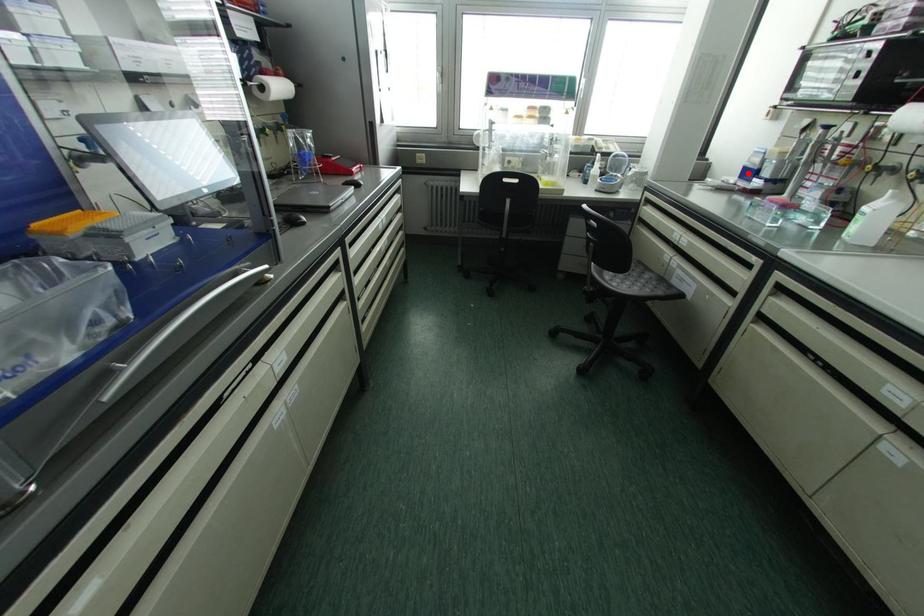
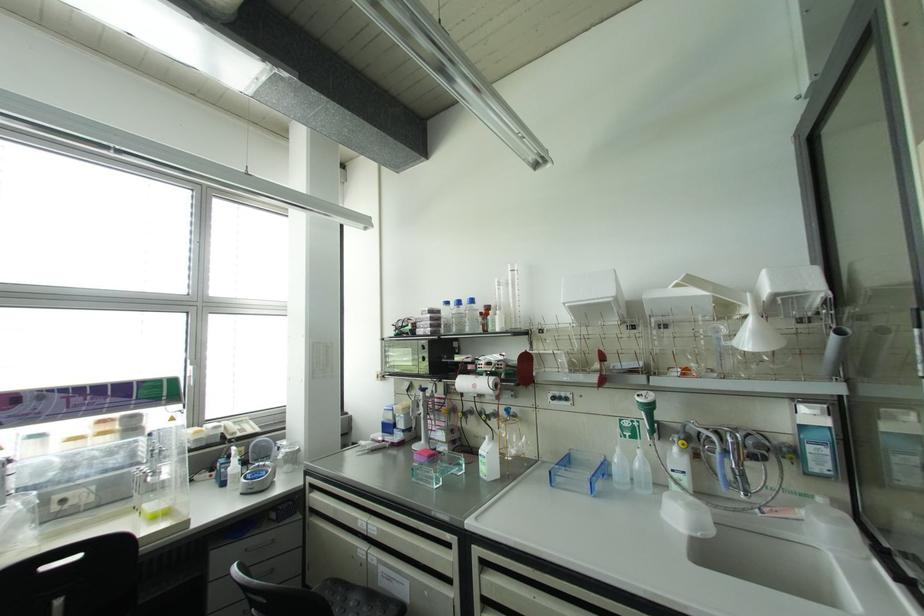
Locate, in the second image, the point that corresponds to the highlighted location in the first image.

(387, 427)